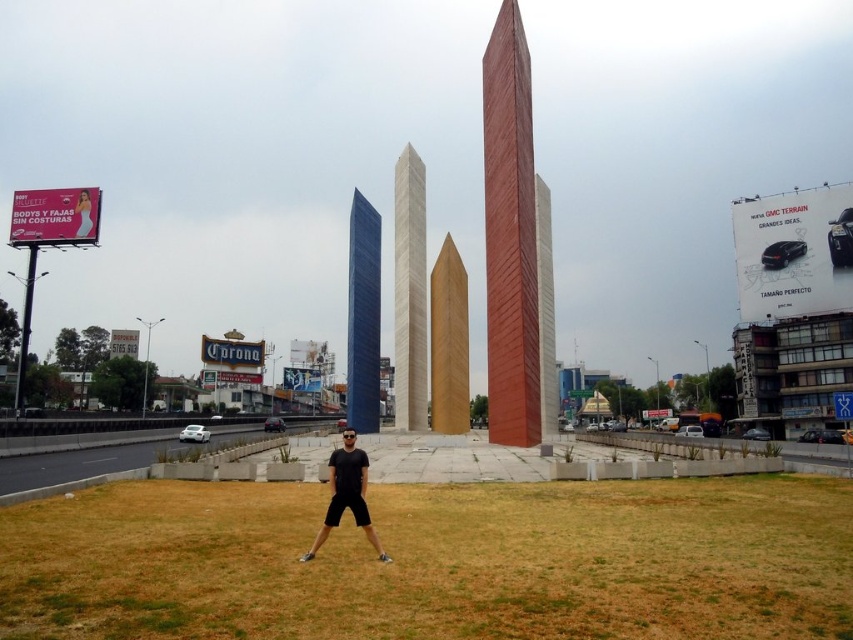
Does point (86, 568) lie in front of point (546, 227)?

Yes, point (86, 568) is closer to viewer.

Does brown dry grass at center have a larger size compared to red brick tower at center?

Incorrect, brown dry grass at center is not larger than red brick tower at center.

Is point (554, 513) behind point (546, 301)?

That is False.

Locate an element on the screen. The height and width of the screenshot is (640, 853). brown dry grass at center is located at coordinates (434, 563).

Find the location of a particular element. The width and height of the screenshot is (853, 640). white marble tower at center is located at coordinates (410, 292).

Between point (409, 307) and point (376, 372), which one is positioned in front?

Point (409, 307) is in front.

You are a GUI agent. You are given a task and a screenshot of the screen. Output one action in this format:
    pyautogui.click(x=<x>, y=<y>)
    Task: Click on the white marble tower at center
    Image resolution: width=853 pixels, height=640 pixels.
    Given the screenshot: What is the action you would take?
    pyautogui.click(x=410, y=292)

Is brown dry grass at center positioned in front of blue glass tower at center?

Yes, it is.

Measure the distance between point (108, 484) and camera.

A distance of 44.01 meters exists between point (108, 484) and camera.

The width and height of the screenshot is (853, 640). In order to click on brown dry grass at center in this screenshot , I will do `click(434, 563)`.